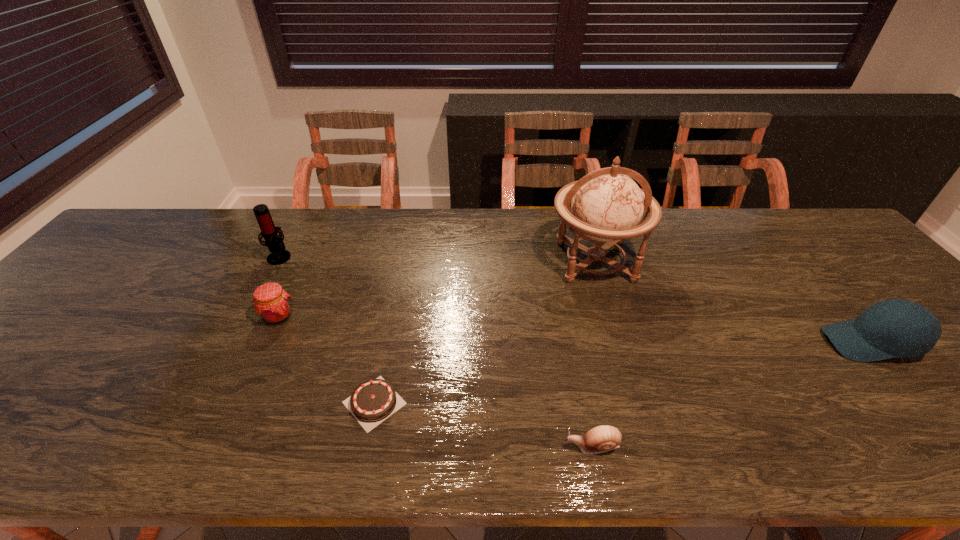
Where is `vacant space located 0.270m on the left of the second nearest object`? vacant space located 0.270m on the left of the second nearest object is located at coordinates (214, 403).

Locate an element on the screen. globe at the far edge is located at coordinates (607, 205).

Where is `microphone that is positioned at the far edge`? The image size is (960, 540). microphone that is positioned at the far edge is located at coordinates (274, 242).

Locate an element on the screen. escargot that is at the near edge is located at coordinates (603, 438).

Locate an element on the screen. chocolate cake present at the near edge is located at coordinates (373, 401).

The width and height of the screenshot is (960, 540). Identify the location of object that is at the right edge. (892, 328).

At what (x,y) coordinates should I click in order to perform the action: click on free space at the far edge of the desktop. Please return your answer as a coordinate pair (x, y). Looking at the image, I should click on (399, 227).

The height and width of the screenshot is (540, 960). What are the coordinates of `vacant position at the near edge of the desktop` in the screenshot? It's located at (792, 453).

The image size is (960, 540). I want to click on vacant point at the left edge, so click(106, 271).

The image size is (960, 540). I want to click on vacant space at the far left corner of the desktop, so click(x=121, y=242).